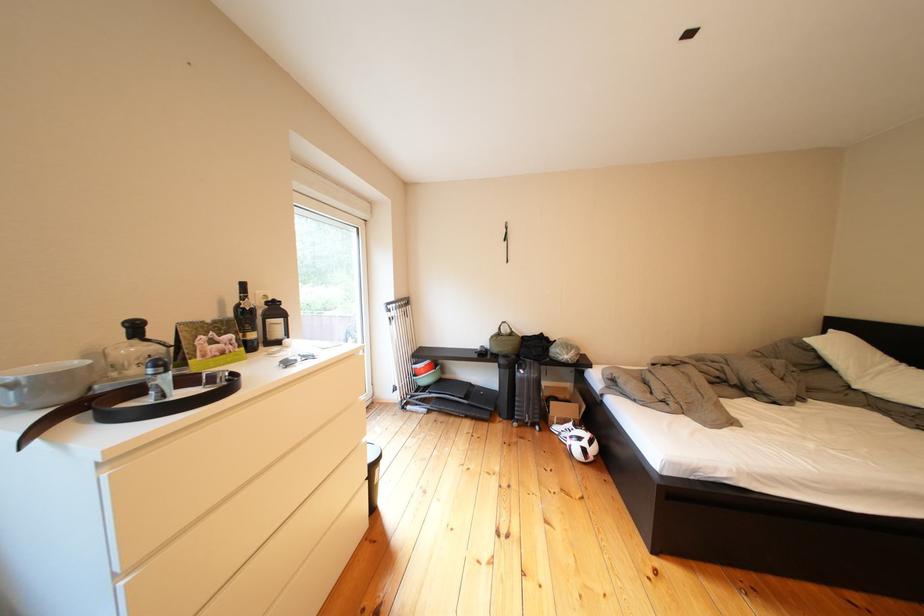
This screenshot has width=924, height=616. Describe the element at coordinates (134, 328) in the screenshot. I see `a glass decanter stopper` at that location.